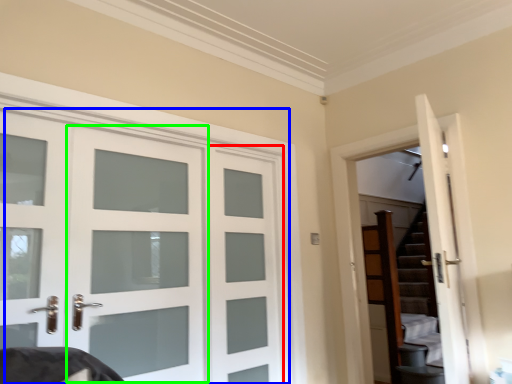
Question: Which object is positioned farthest from screen door (highlighted by a red box)? Select from door (highlighted by a blue box) and screen door (highlighted by a green box).

Choices:
 (A) door
 (B) screen door

Answer: (B)